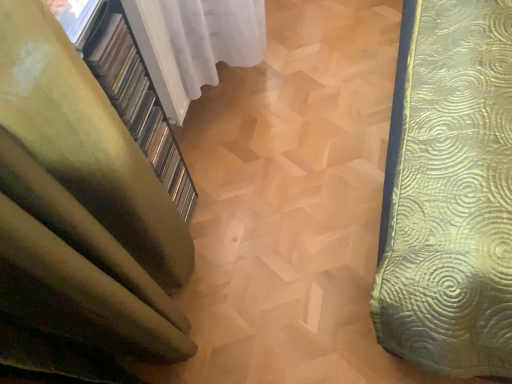
Question: Does green fabric curtain at left, the 1th curtain in the bottom-to-top sequence, come in front of transparent glass window at upper left?

Choices:
 (A) yes
 (B) no

Answer: (A)

Question: Considering the relative sizes of green fabric curtain at left, the 1th curtain in the bottom-to-top sequence, and transparent glass window at upper left in the image provided, is green fabric curtain at left, the 1th curtain in the bottom-to-top sequence, bigger than transparent glass window at upper left?

Choices:
 (A) no
 (B) yes

Answer: (B)

Question: Is transparent glass window at upper left at the back of green fabric curtain at left, which appears as the 2th curtain when viewed from the top?

Choices:
 (A) yes
 (B) no

Answer: (B)

Question: Is green fabric curtain at left, which appears as the 2th curtain when viewed from the top, smaller than transparent glass window at upper left?

Choices:
 (A) no
 (B) yes

Answer: (A)

Question: From a real-world perspective, is green fabric curtain at left, the 1th curtain in the bottom-to-top sequence, located higher than transparent glass window at upper left?

Choices:
 (A) no
 (B) yes

Answer: (A)

Question: Choose the correct answer: Is green fabric curtain at left, which appears as the 2th curtain when viewed from the top, inside transparent glass window at upper left or outside it?

Choices:
 (A) inside
 (B) outside

Answer: (B)

Question: Does point (62, 324) appear closer or farther from the camera than point (59, 0)?

Choices:
 (A) farther
 (B) closer

Answer: (B)

Question: Based on their sizes in the image, would you say green fabric curtain at left, which appears as the 2th curtain when viewed from the top, is bigger or smaller than transparent glass window at upper left?

Choices:
 (A) big
 (B) small

Answer: (A)

Question: From the image's perspective, is green fabric curtain at left, which appears as the 2th curtain when viewed from the top, located above or below transparent glass window at upper left?

Choices:
 (A) above
 (B) below

Answer: (B)

Question: Considering the positions of point coord(224,31) and point coord(68,3), is point coord(224,31) closer or farther from the camera than point coord(68,3)?

Choices:
 (A) farther
 (B) closer

Answer: (A)

Question: From a real-world perspective, relative to transparent glass window at upper left, is white sheer curtain at upper left, the 1th curtain when ordered from top to bottom, vertically above or below?

Choices:
 (A) above
 (B) below

Answer: (B)

Question: Do you think white sheer curtain at upper left, positioned as the second curtain in bottom-to-top order, is within transparent glass window at upper left, or outside of it?

Choices:
 (A) outside
 (B) inside

Answer: (A)

Question: Would you say white sheer curtain at upper left, the 1th curtain when ordered from top to bottom, is to the left or to the right of transparent glass window at upper left in the picture?

Choices:
 (A) left
 (B) right

Answer: (B)

Question: Is point (196, 59) positioned closer to the camera than point (84, 211)?

Choices:
 (A) closer
 (B) farther

Answer: (B)

Question: From a real-world perspective, relative to green fabric curtain at left, the 1th curtain in the bottom-to-top sequence, is white sheer curtain at upper left, the 1th curtain when ordered from top to bottom, vertically above or below?

Choices:
 (A) above
 (B) below

Answer: (B)